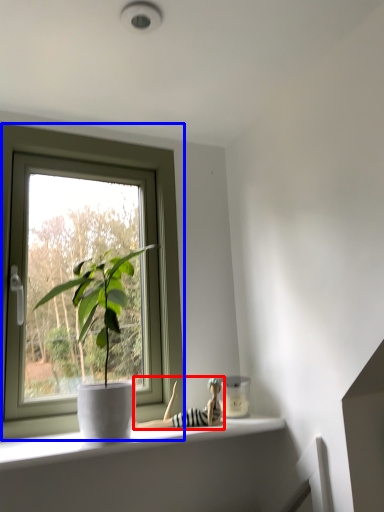
Question: Which of the following is the farthest to the observer, toy (highlighted by a red box) or window (highlighted by a blue box)?

Choices:
 (A) toy
 (B) window

Answer: (A)